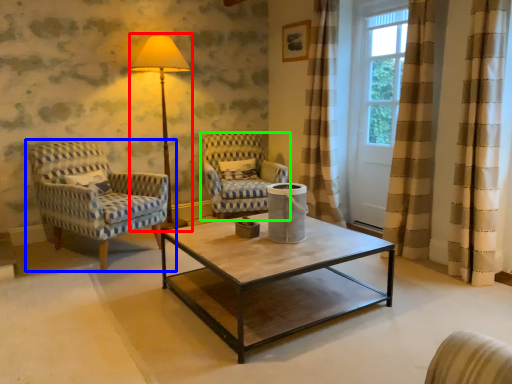
Question: Which is nearer to the table lamp (highlighted by a red box)? chair (highlighted by a blue box) or chair (highlighted by a green box).

Choices:
 (A) chair
 (B) chair

Answer: (B)